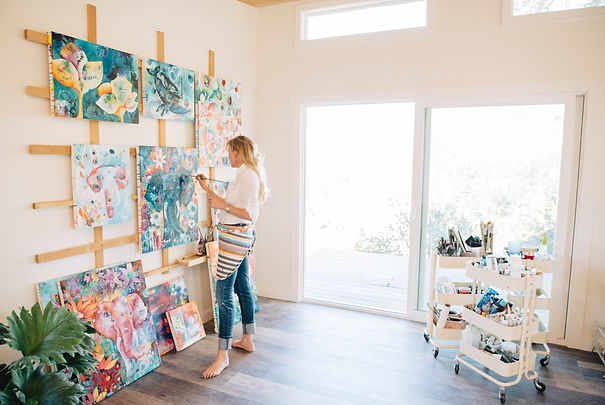
Where is `glass`? The height and width of the screenshot is (405, 605). glass is located at coordinates (318, 23), (537, 7).